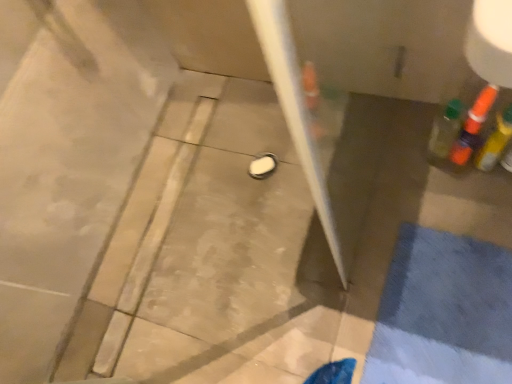
Where is `free space to the back side of translucent orange bottle at upper right, the second bottle when ordered from right to left`? Image resolution: width=512 pixels, height=384 pixels. free space to the back side of translucent orange bottle at upper right, the second bottle when ordered from right to left is located at coordinates (407, 120).